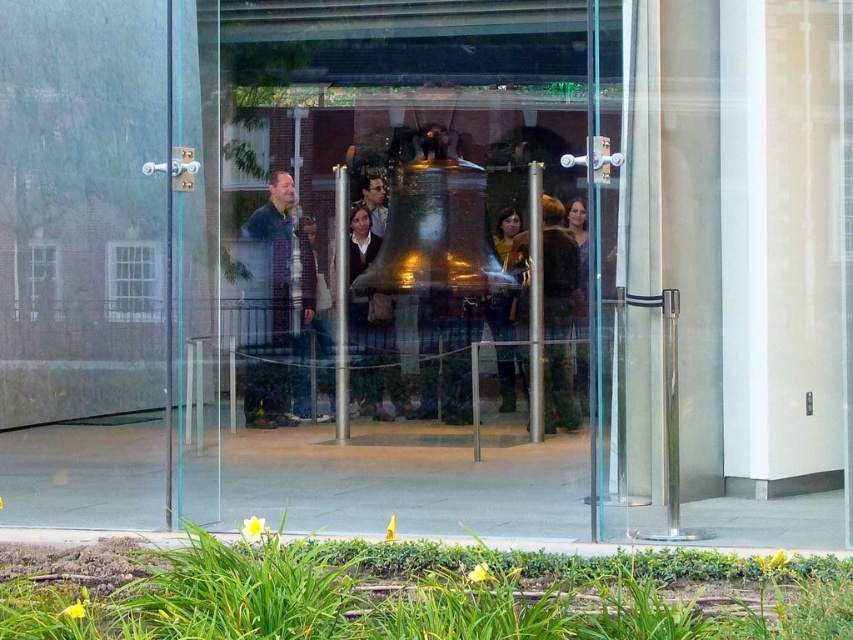
Which is behind, point (554, 292) or point (311, 228)?

The point (311, 228) is more distant.

What do you see at coordinates (556, 272) in the screenshot? I see `brown leather jacket at center` at bounding box center [556, 272].

Between point (570, 387) and point (334, 380), which one is positioned in front?

Positioned in front is point (570, 387).

At what (x,y) coordinates should I click in order to perform the action: click on brown leather jacket at center. Please return your answer as a coordinate pair (x, y). Looking at the image, I should click on (556, 272).

Is transparent glass door at center thinner than brown leather jacket at center?

No.

Where is `transparent glass door at center`? The height and width of the screenshot is (640, 853). transparent glass door at center is located at coordinates (403, 252).

Measure the distance between point (508, 180) and camera.

Point (508, 180) and camera are 12.62 meters apart from each other.

At what (x,y) coordinates should I click in order to perform the action: click on transparent glass door at center. Please return your answer as a coordinate pair (x, y). Looking at the image, I should click on pos(403,252).

Is brown leather jacket at center to the right of matte brown jacket at center from the viewer's perspective?

Correct, you'll find brown leather jacket at center to the right of matte brown jacket at center.

This screenshot has height=640, width=853. Identify the location of brown leather jacket at center. (x=556, y=272).

Locate an element on the screen. brown leather jacket at center is located at coordinates (556, 272).